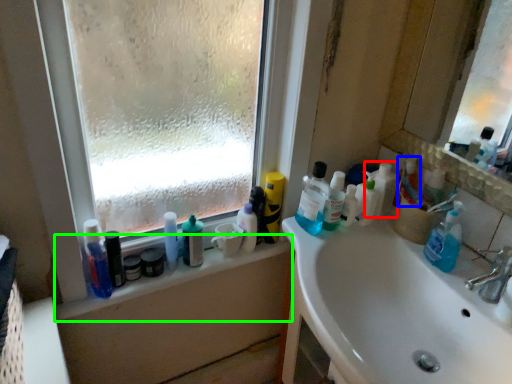
Question: Based on their relative distances, which object is nearer to cleaning product (highlighted by a red box)? Choose from toiletry (highlighted by a blue box) and window sill (highlighted by a green box).

Choices:
 (A) toiletry
 (B) window sill

Answer: (A)